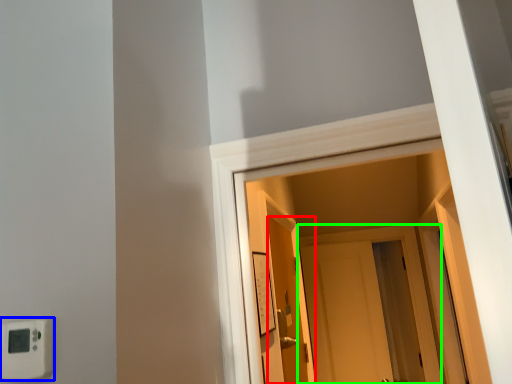
Question: Estimate the real-world distances between objects in this image. Which object is closer to door (highlighted by a red box), light switch (highlighted by a blue box) or door (highlighted by a green box)?

Choices:
 (A) light switch
 (B) door

Answer: (B)